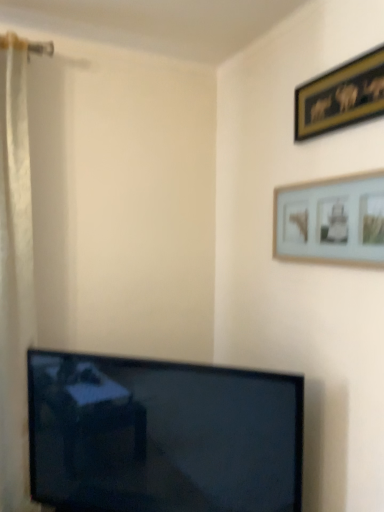
Question: In terms of size, does gold-framed picture at upper right, the 1th picture frame viewed from the top, appear bigger or smaller than white matte picture frame at upper right, the 1th picture frame ordered from the bottom?

Choices:
 (A) small
 (B) big

Answer: (A)

Question: From the image's perspective, is gold-framed picture at upper right, the 2th picture frame when ordered from bottom to top, located above or below white matte picture frame at upper right, the 1th picture frame ordered from the bottom?

Choices:
 (A) above
 (B) below

Answer: (A)

Question: Considering the positions of gold-framed picture at upper right, the 1th picture frame viewed from the top, and white matte picture frame at upper right, the 1th picture frame ordered from the bottom, in the image, is gold-framed picture at upper right, the 1th picture frame viewed from the top, taller or shorter than white matte picture frame at upper right, the 1th picture frame ordered from the bottom,?

Choices:
 (A) short
 (B) tall

Answer: (A)

Question: Is white matte picture frame at upper right, which is counted as the second picture frame, starting from the top, to the left or to the right of gold-framed picture at upper right, the 1th picture frame viewed from the top, in the image?

Choices:
 (A) left
 (B) right

Answer: (A)

Question: Considering the positions of white matte picture frame at upper right, the 1th picture frame ordered from the bottom, and gold-framed picture at upper right, the 1th picture frame viewed from the top, in the image, is white matte picture frame at upper right, the 1th picture frame ordered from the bottom, bigger or smaller than gold-framed picture at upper right, the 1th picture frame viewed from the top,?

Choices:
 (A) big
 (B) small

Answer: (A)

Question: In terms of width, does white matte picture frame at upper right, the 1th picture frame ordered from the bottom, look wider or thinner when compared to gold-framed picture at upper right, the 2th picture frame when ordered from bottom to top?

Choices:
 (A) thin
 (B) wide

Answer: (B)

Question: Considering their positions, is white matte picture frame at upper right, which is counted as the second picture frame, starting from the top, located in front of or behind gold-framed picture at upper right, the 2th picture frame when ordered from bottom to top?

Choices:
 (A) behind
 (B) front

Answer: (B)